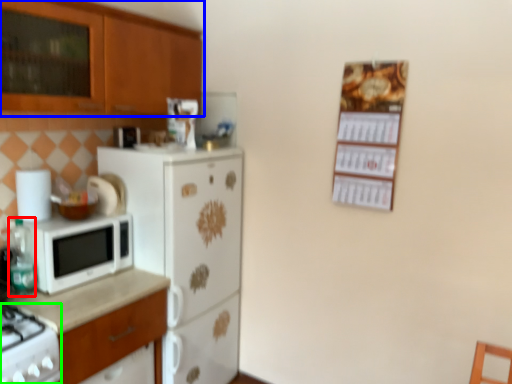
Question: Based on their relative distances, which object is nearer to bottle (highlighted by a red box)? Choose from cabinetry (highlighted by a blue box) and gas stove (highlighted by a green box).

Choices:
 (A) cabinetry
 (B) gas stove

Answer: (B)